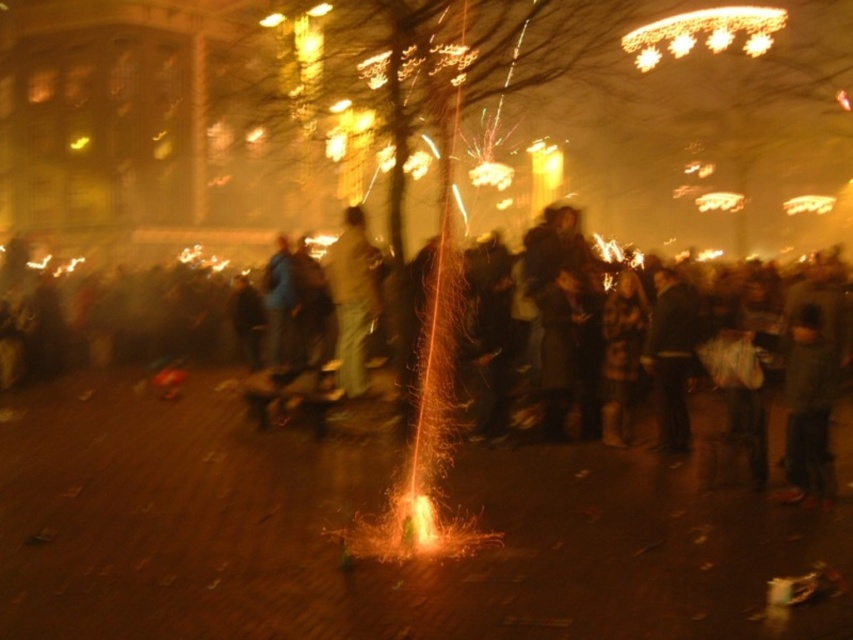
You are standing in the crowd and want to move to the right side of the dark gray sweater at center. Is the dark clothing crowd at center blocking your path?

The dark clothing crowd at center is to the left of the dark gray sweater at center, so moving to the right side of the dark gray sweater at center would not be blocked by the crowd since they are positioned to the left.

You are standing at the origin point of the image. Where is the dark clothing crowd at center located?

The dark clothing crowd at center is located at point 0.508 in the x axis and 0.413 in the y axis.